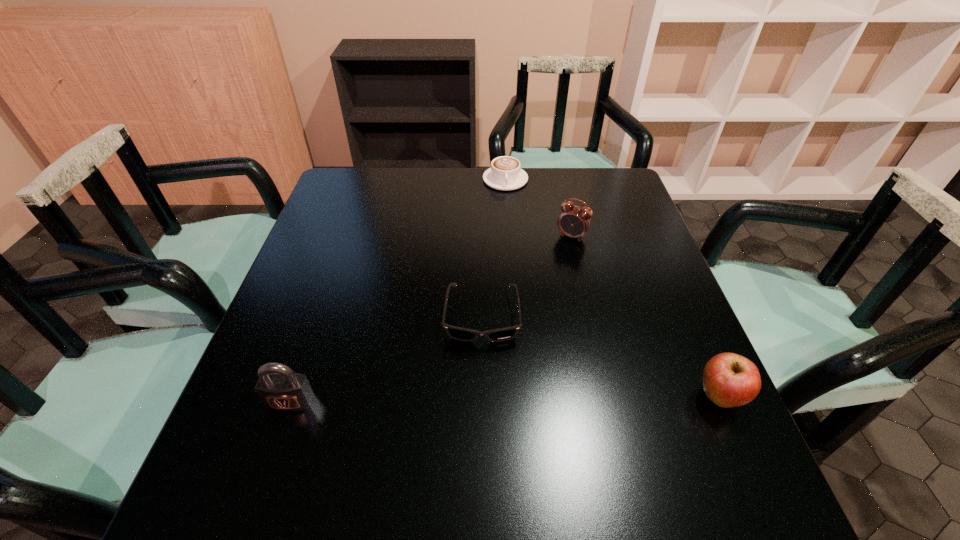
Identify the location of vacant space located on the front-facing side of the third farthest object. This screenshot has height=540, width=960. (480, 388).

Image resolution: width=960 pixels, height=540 pixels. I want to click on free region located 0.230m on the front-facing side of the third farthest object, so click(x=479, y=452).

Where is `vacant point located on the front-facing side of the third farthest object`? vacant point located on the front-facing side of the third farthest object is located at coordinates (480, 379).

Where is `vacant space located 0.310m with the handle on the right side of the farthest object`? The height and width of the screenshot is (540, 960). vacant space located 0.310m with the handle on the right side of the farthest object is located at coordinates (526, 258).

Identify the location of free space located 0.360m with the handle on the right side of the farthest object. (530, 271).

At what (x,y) coordinates should I click in order to perform the action: click on free space located with the handle on the right side of the farthest object. Please return your answer as a coordinate pair (x, y). The width and height of the screenshot is (960, 540). Looking at the image, I should click on (513, 208).

This screenshot has height=540, width=960. I want to click on object that is at the far edge, so click(x=505, y=173).

Locate an element on the screen. padlock located at the near edge is located at coordinates (283, 390).

What are the coordinates of `apple positioned at the near edge` in the screenshot? It's located at click(730, 380).

Identify the location of object located in the left edge section of the desktop. coord(283,390).